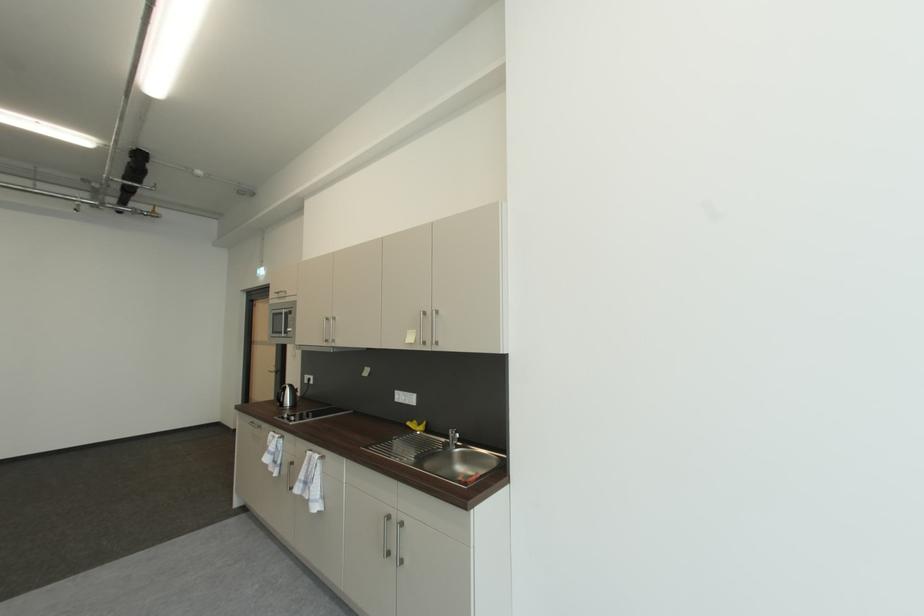
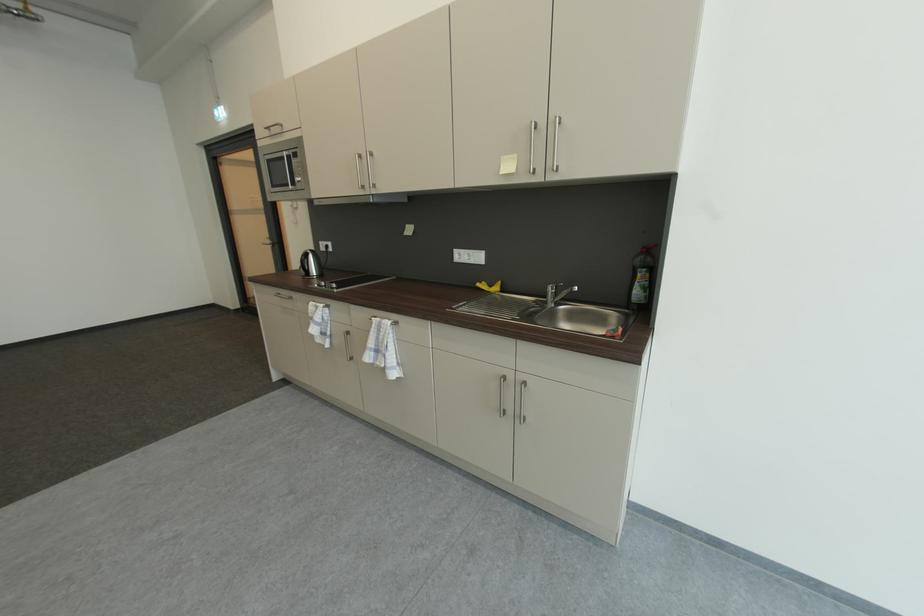
In the second image, find the point that corresponds to point 334,321 in the first image.

(367, 158)